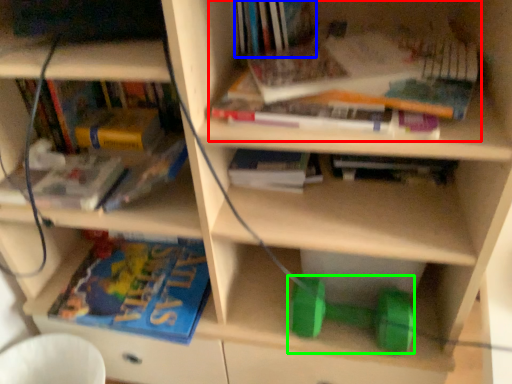
Question: Which object is positioned closest to book (highlighted by a red box)? Select from book (highlighted by a blue box) and dumbbell (highlighted by a green box).

Choices:
 (A) book
 (B) dumbbell

Answer: (A)